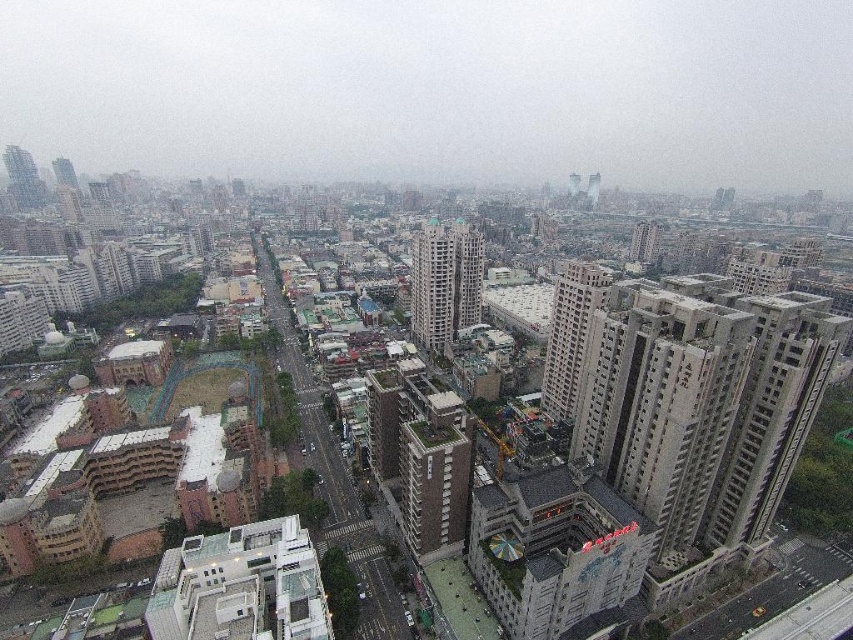
Measure the distance from gray concrete building at right to gray concrete building at center-right.

gray concrete building at right and gray concrete building at center-right are 55.47 meters apart from each other.

Who is positioned more to the right, gray concrete building at right or gray concrete building at center-right?

Positioned to the right is gray concrete building at right.

Locate an element on the screen. This screenshot has width=853, height=640. gray concrete building at right is located at coordinates (772, 412).

Which of these two, brown brick building at center or beige concrete building at center, stands taller?

With more height is beige concrete building at center.

Between point (428, 433) and point (427, 280), which one is positioned in front?

Point (428, 433)

Identify the location of brown brick building at center. The height and width of the screenshot is (640, 853). (433, 484).

Which is in front, point (480, 304) or point (543, 408)?

Point (543, 408)

Is beige concrete building at center positioned behind gray concrete building at center-right?

Yes, it is.

This screenshot has height=640, width=853. I want to click on beige concrete building at center, so click(444, 282).

Identify the location of beige concrete building at center. (444, 282).